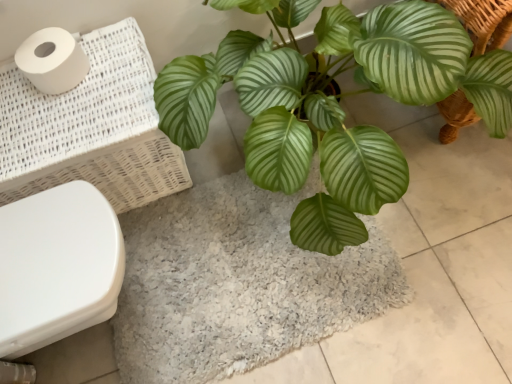
Question: In terms of size, does gray shaggy bath mat at center appear bigger or smaller than white glossy toilet bowl at lower left?

Choices:
 (A) small
 (B) big

Answer: (A)

Question: Is gray shaggy bath mat at center wider or thinner than white glossy toilet bowl at lower left?

Choices:
 (A) thin
 (B) wide

Answer: (B)

Question: Estimate the real-world distances between objects in this image. Which object is farther from the white woven laundry basket at left?

Choices:
 (A) green glossy leafy plant at center
 (B) white matte toilet paper at upper left
 (C) white glossy toilet bowl at lower left
 (D) gray shaggy bath mat at center

Answer: (D)

Question: Which object is positioned farthest from the white matte toilet paper at upper left?

Choices:
 (A) green glossy leafy plant at center
 (B) white glossy toilet bowl at lower left
 (C) white woven laundry basket at left
 (D) gray shaggy bath mat at center

Answer: (D)